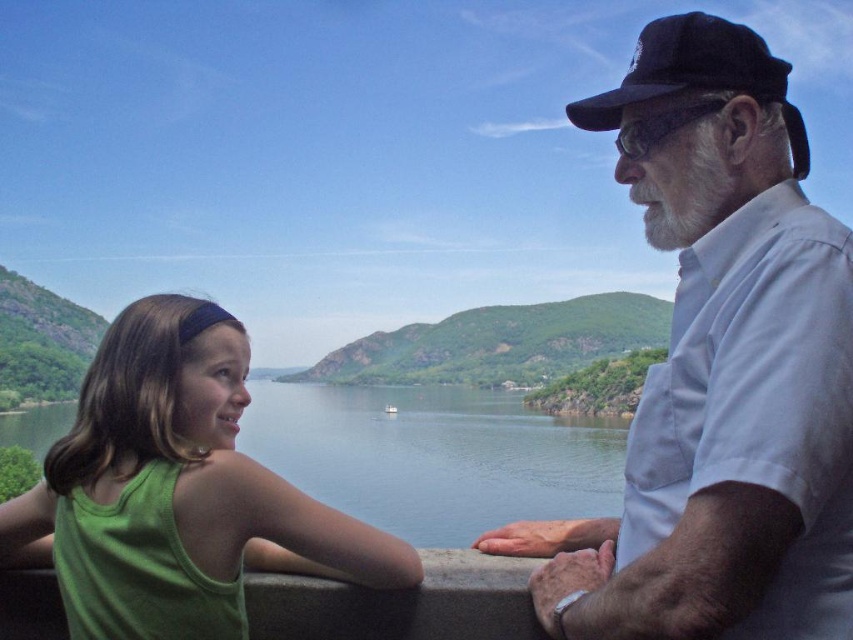
Can you confirm if green fabric tank top at left is positioned above black felt baseball cap at upper right?

Actually, green fabric tank top at left is below black felt baseball cap at upper right.

Does green fabric tank top at left have a larger size compared to black felt baseball cap at upper right?

No.

The image size is (853, 640). What do you see at coordinates (177, 490) in the screenshot?
I see `green fabric tank top at left` at bounding box center [177, 490].

In order to click on green fabric tank top at left in this screenshot , I will do click(177, 490).

Does green fabric tank top at left have a larger size compared to green water at lower left?

Actually, green fabric tank top at left might be smaller than green water at lower left.

Between green fabric tank top at left and green water at lower left, which one is positioned lower?

Positioned lower is green water at lower left.

Where is `green fabric tank top at left`? This screenshot has height=640, width=853. green fabric tank top at left is located at coordinates (177, 490).

Who is positioned more to the right, white shirt at right or green fabric tank top at left?

Positioned to the right is white shirt at right.

Is point (664, 115) positioned behind point (152, 420)?

Yes, point (664, 115) is behind point (152, 420).

Where is `white shirt at right`? The image size is (853, 640). white shirt at right is located at coordinates (718, 369).